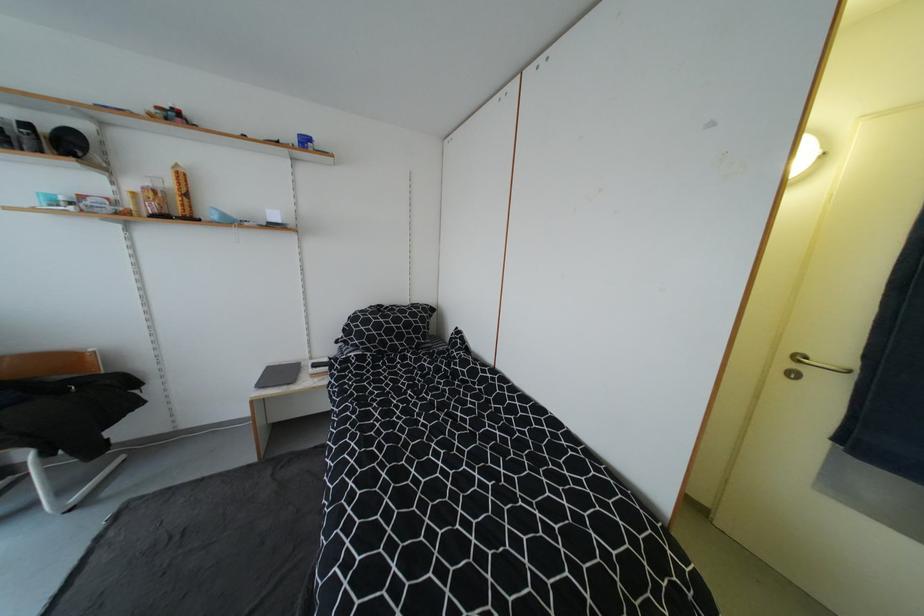
Locate an element on the screen. The width and height of the screenshot is (924, 616). black patterned pillow is located at coordinates (385, 329).